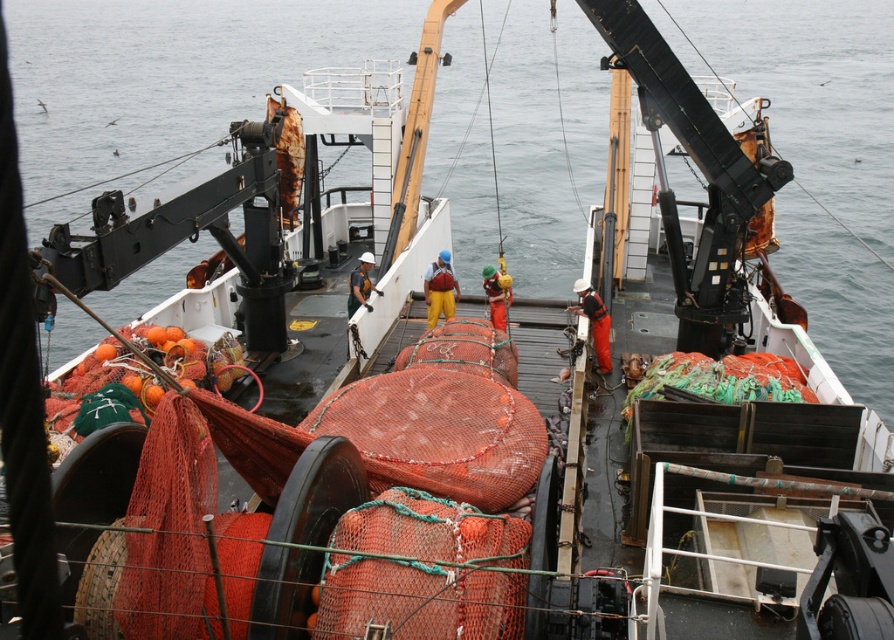
Is orange fabric at center positioned behind matte orange net at center?

No, it is not.

Is point (572, 310) positioned after point (370, 310)?

Yes, point (572, 310) is farther from viewer.

You are a GUI agent. You are given a task and a screenshot of the screen. Output one action in this format:
    pyautogui.click(x=<x>, y=<y>)
    Task: Click on the orange fabric at center
    Image resolution: width=894 pixels, height=640 pixels.
    Given the screenshot: What is the action you would take?
    pyautogui.click(x=595, y=321)

Does point (437, 292) lie behind point (574, 288)?

Yes, it is.

Does yellow fabric at center appear under orange fabric at center?

No.

Is point (445, 272) farther from viewer compared to point (596, 310)?

Yes, it is.

Find the location of a particular element. yellow fabric at center is located at coordinates (439, 289).

Is point (504, 314) behind point (367, 257)?

That is False.

Looking at this image, which is more to the left, orange fabric worker at center or matte orange net at center?

matte orange net at center is more to the left.

Identify the location of orange fabric worker at center. (496, 296).

The width and height of the screenshot is (894, 640). What are the coordinates of `orange fabric worker at center` in the screenshot? It's located at (496, 296).